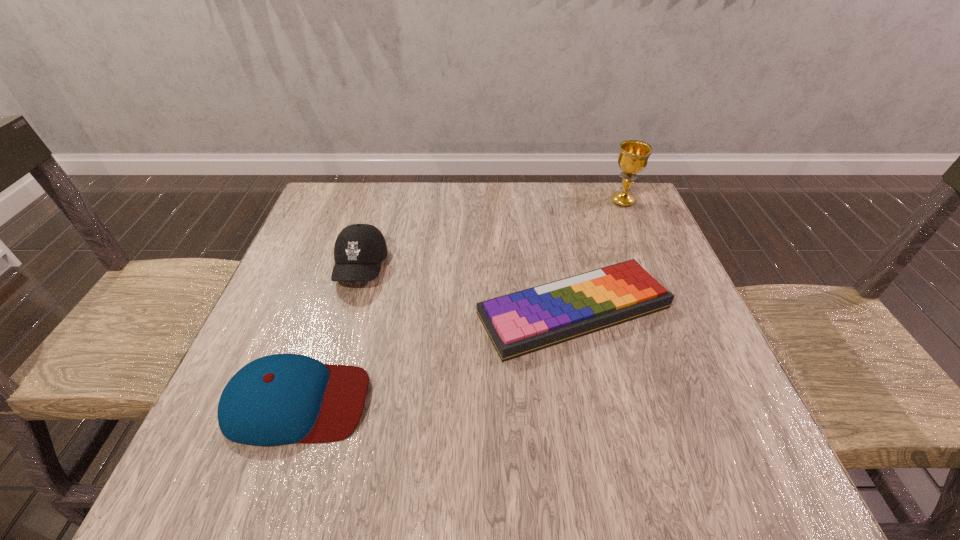
This screenshot has width=960, height=540. In order to click on chalice in this screenshot , I will do `click(633, 156)`.

Locate an element on the screen. The image size is (960, 540). the tallest object is located at coordinates (633, 156).

This screenshot has width=960, height=540. I want to click on the taller baseball cap, so click(x=359, y=250).

Locate an element on the screen. The height and width of the screenshot is (540, 960). the second tallest object is located at coordinates (359, 250).

You are a GUI agent. You are given a task and a screenshot of the screen. Output one action in this format:
    pyautogui.click(x=<x>, y=<y>)
    Task: Click on the nearer baseball cap
    This screenshot has height=540, width=960.
    Given the screenshot: What is the action you would take?
    pyautogui.click(x=279, y=399)

You are a GUI agent. You are given a task and a screenshot of the screen. Output one action in this format:
    pyautogui.click(x=<x>, y=<y>)
    Task: Click on the shorter baseball cap
    
    Given the screenshot: What is the action you would take?
    [279, 399]

In order to click on the shortest object in this screenshot , I will do click(520, 323).

Image resolution: width=960 pixels, height=540 pixels. In order to click on free space located 0.370m on the left of the farthest object in this screenshot , I will do `click(476, 201)`.

The image size is (960, 540). In order to click on free space located 0.300m on the front-facing side of the farther baseball cap in this screenshot , I will do [315, 423].

Locate an element on the screen. The width and height of the screenshot is (960, 540). free location located 0.100m with the bill of the third tallest object facing forward is located at coordinates (424, 402).